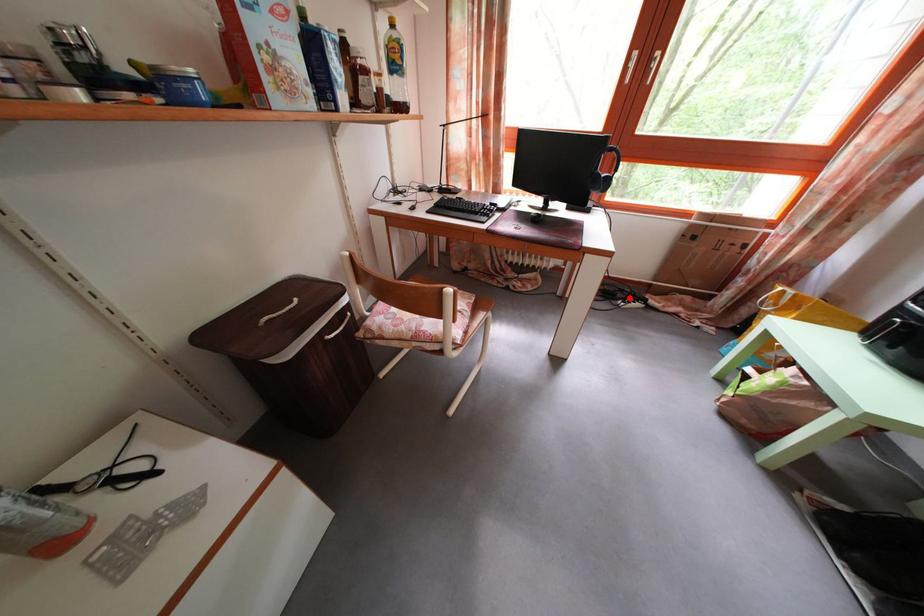
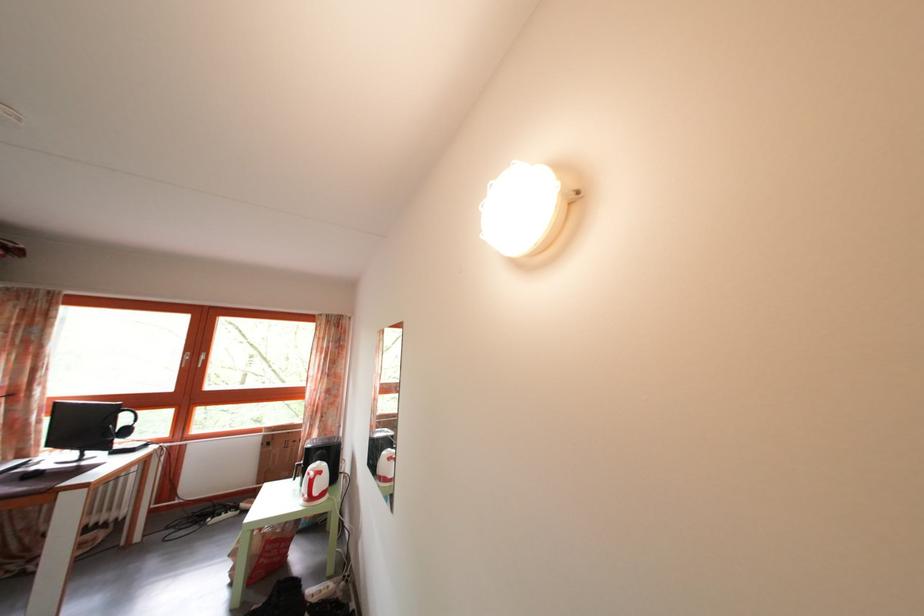
The point at the highlighted location is marked in the first image. Where is the corresponding point in the second image?

(233, 514)